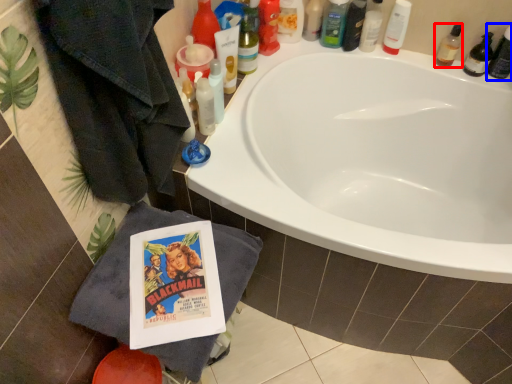
Question: Which of the following is the farthest to the observer, toiletry (highlighted by a red box) or toiletry (highlighted by a blue box)?

Choices:
 (A) toiletry
 (B) toiletry

Answer: (A)